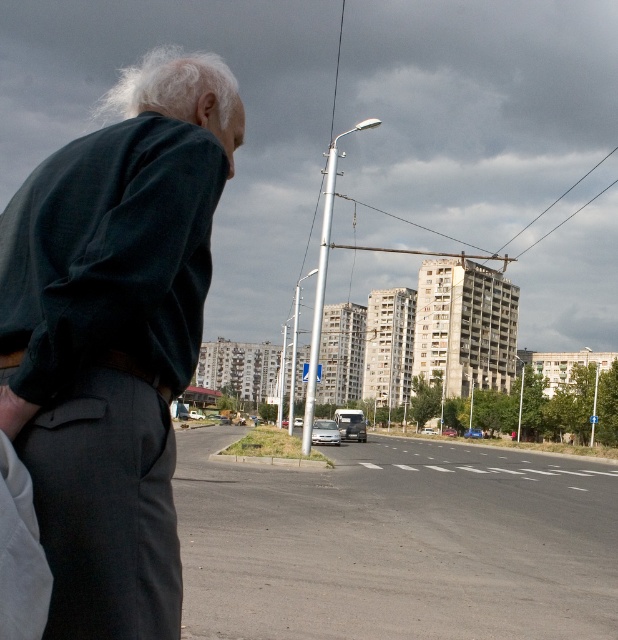
Between dark green fabric jacket at left and brown leather belt at lower left, which one is positioned higher?

dark green fabric jacket at left is above.

Does dark green fabric jacket at left come in front of brown leather belt at lower left?

No, it is behind brown leather belt at lower left.

The image size is (618, 640). In order to click on dark green fabric jacket at left in this screenshot , I will do `click(112, 337)`.